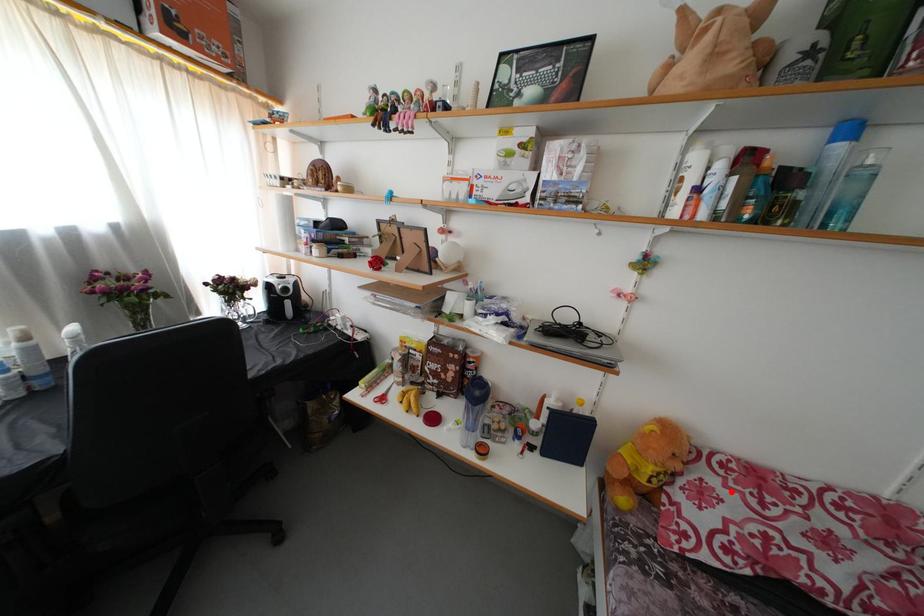
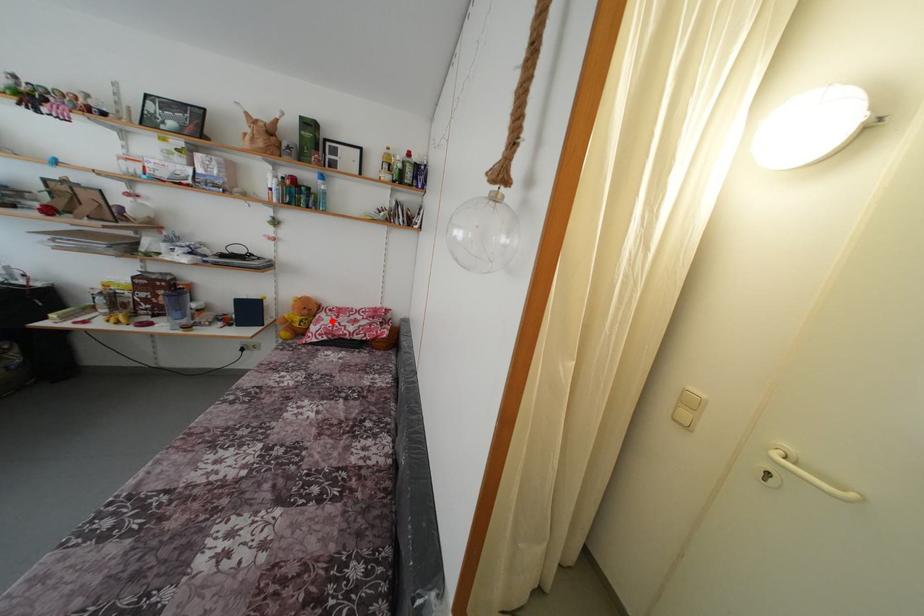
I am providing you with two images of the same scene from different viewpoints. A red point is marked on the first image and another point is marked on the second image. Do the highlighted points in image1 and image2 indicate the same real-world spot?

Yes